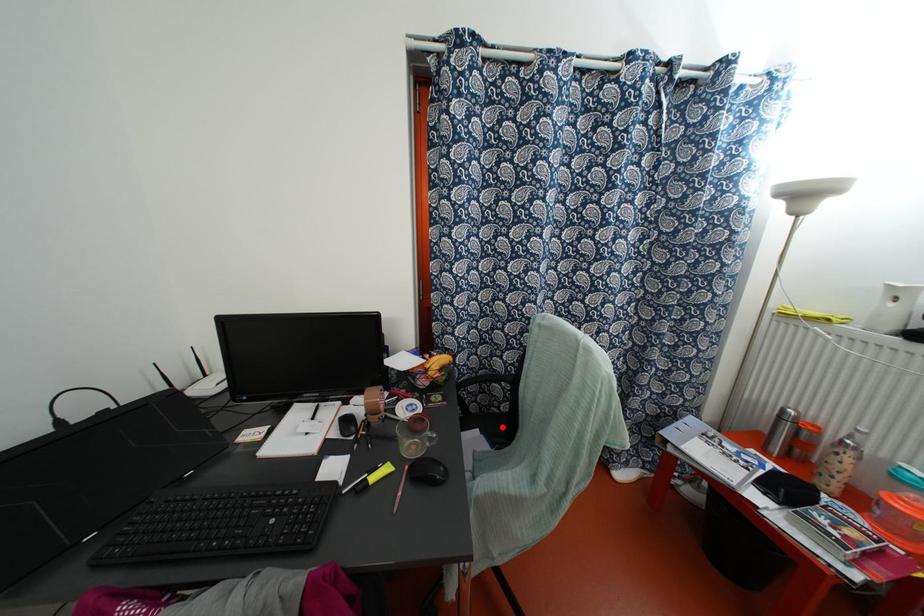
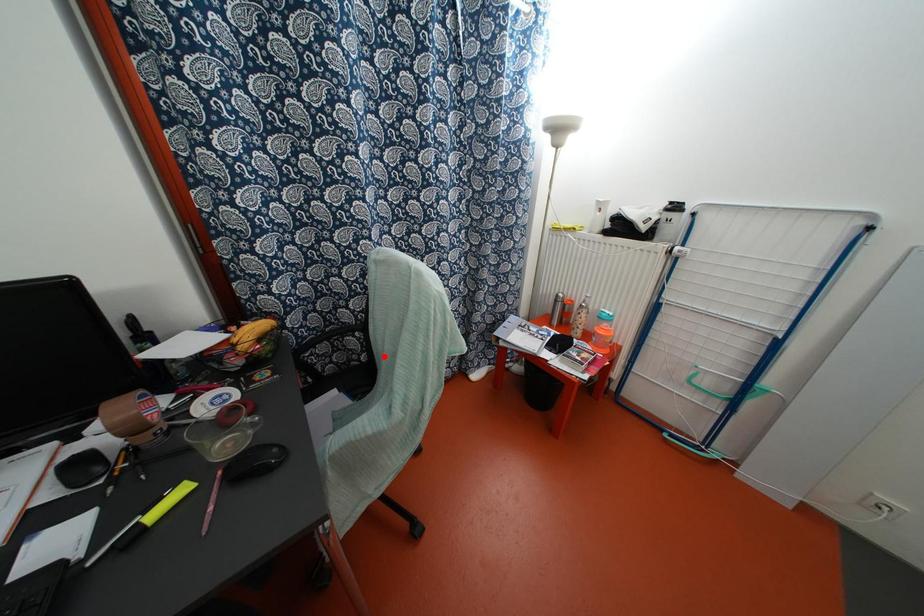
I am providing you with two images of the same scene from different viewpoints. A red point is marked on the first image and another point is marked on the second image. Is the red point in image1 aligned with the point shown in image2?

No